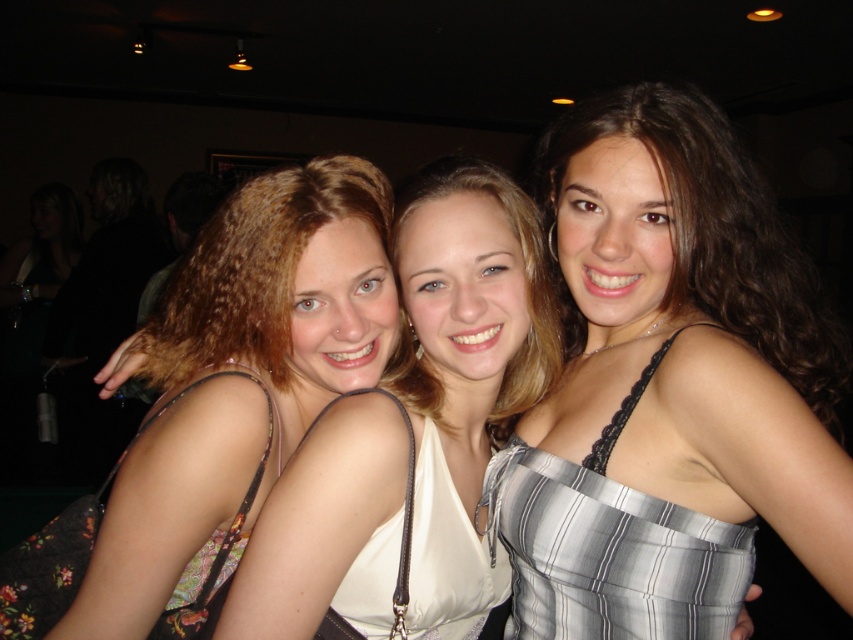
Question: Is blonde hair at left above matte floral dress at center?

Choices:
 (A) no
 (B) yes

Answer: (B)

Question: Among these objects, which one is farthest from the camera?

Choices:
 (A) matte floral dress at center
 (B) striped satin dress at center
 (C) silver striped dress at center

Answer: (A)

Question: Which of the following is the farthest from the observer?

Choices:
 (A) blonde hair at left
 (B) striped satin dress at center
 (C) silver striped dress at center

Answer: (A)

Question: Which point is closer to the camera?

Choices:
 (A) striped satin dress at center
 (B) white satin dress at center
 (C) silver striped dress at center
 (D) matte floral dress at center

Answer: (C)

Question: Can you confirm if white satin dress at center is smaller than floral-patterned fabric dress at left?

Choices:
 (A) no
 (B) yes

Answer: (B)

Question: Is blonde hair at left closer to camera compared to floral-patterned fabric dress at left?

Choices:
 (A) no
 (B) yes

Answer: (B)